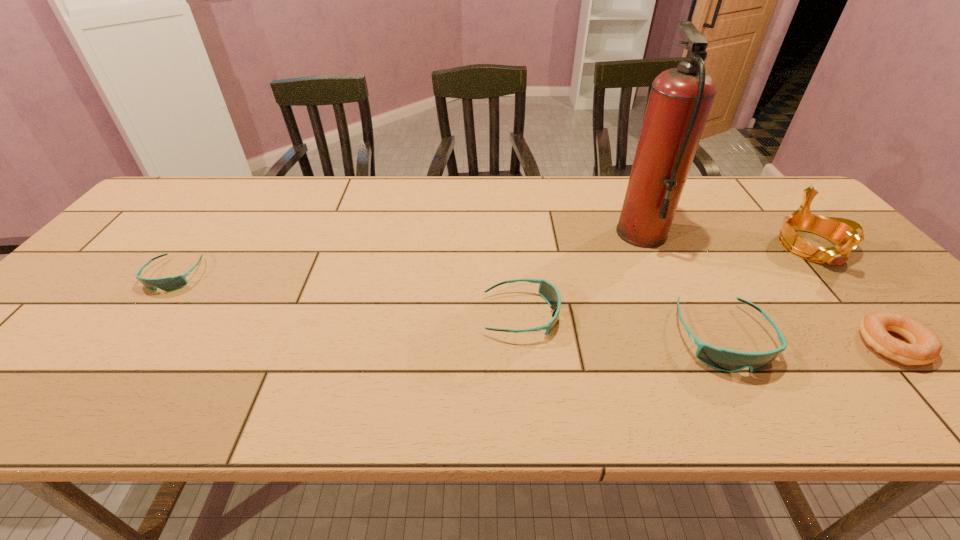
This screenshot has width=960, height=540. Identify the location of object that is positioned at the near right corner. (925, 346).

This screenshot has height=540, width=960. In the image, there is a desktop. Find the location of `vacant space at the far edge`. vacant space at the far edge is located at coordinates (377, 200).

At what (x,y) coordinates should I click in order to perform the action: click on vacant space at the near edge of the desktop. Please return your answer as a coordinate pair (x, y). This screenshot has height=540, width=960. Looking at the image, I should click on (623, 342).

In the image, there is a desktop. Identify the location of vacant space at the left edge. (113, 277).

Where is `vacant point at the far left corner`? The image size is (960, 540). vacant point at the far left corner is located at coordinates click(198, 194).

Identify the location of blank area at the far right corner. (782, 195).

Locate an element on the screen. The width and height of the screenshot is (960, 540). free space between the tallest object and the second tallest object is located at coordinates 727,240.

Find the location of `empty space that is in between the tiara and the fire extinguisher`. empty space that is in between the tiara and the fire extinguisher is located at coordinates (727, 240).

Where is `vacant area that lies between the rightmost sunglasses and the bagel`? This screenshot has width=960, height=540. vacant area that lies between the rightmost sunglasses and the bagel is located at coordinates (807, 341).

Locate an element on the screen. Image resolution: width=960 pixels, height=540 pixels. free space between the tallest object and the tallest sunglasses is located at coordinates (682, 286).